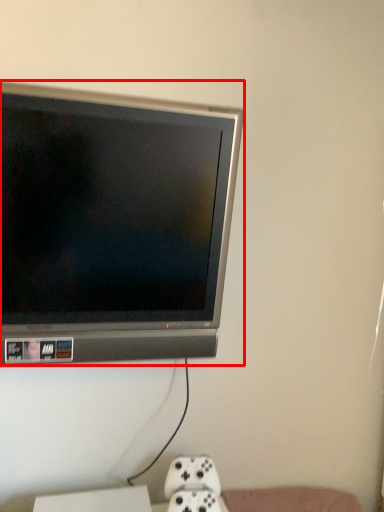
Question: From the image's perspective, what is the correct spatial positioning of television (annotated by the red box) in reference to game controller?

Choices:
 (A) above
 (B) below

Answer: (A)